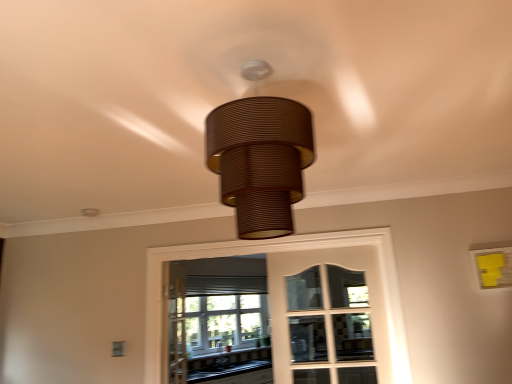
Question: From the image's perspective, is matte glass bay window at center above black laminate countertop at lower center?

Choices:
 (A) no
 (B) yes

Answer: (B)

Question: Can you confirm if matte glass bay window at center is thinner than black laminate countertop at lower center?

Choices:
 (A) yes
 (B) no

Answer: (A)

Question: Is matte glass bay window at center taller than black laminate countertop at lower center?

Choices:
 (A) no
 (B) yes

Answer: (B)

Question: Is the position of matte glass bay window at center less distant than that of black laminate countertop at lower center?

Choices:
 (A) yes
 (B) no

Answer: (B)

Question: From a real-world perspective, is matte glass bay window at center on top of black laminate countertop at lower center?

Choices:
 (A) yes
 (B) no

Answer: (A)

Question: Is matte glass bay window at center located outside black laminate countertop at lower center?

Choices:
 (A) yes
 (B) no

Answer: (A)

Question: Is clear glass window at center a part of black laminate countertop at lower center?

Choices:
 (A) no
 (B) yes

Answer: (A)

Question: Can we say black laminate countertop at lower center lies outside clear glass window at center?

Choices:
 (A) no
 (B) yes

Answer: (B)

Question: Is black laminate countertop at lower center at the left side of clear glass window at center?

Choices:
 (A) yes
 (B) no

Answer: (A)

Question: From the image's perspective, would you say black laminate countertop at lower center is shown under clear glass window at center?

Choices:
 (A) no
 (B) yes

Answer: (B)

Question: From a real-world perspective, does black laminate countertop at lower center stand above clear glass window at center?

Choices:
 (A) yes
 (B) no

Answer: (B)

Question: From a real-world perspective, is black laminate countertop at lower center located beneath clear glass window at center?

Choices:
 (A) no
 (B) yes

Answer: (B)

Question: Is brown textured lampshade at center thinner than clear glass window at center?

Choices:
 (A) no
 (B) yes

Answer: (A)